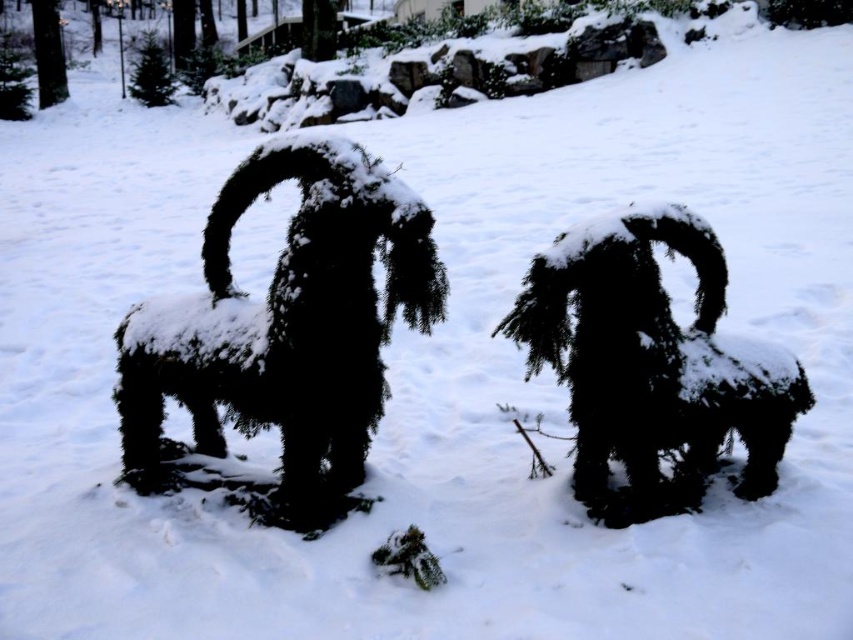
Is green textured evergreen at center thinner than fuzzy dark green bush at center?

Incorrect, green textured evergreen at center's width is not less than fuzzy dark green bush at center's.

You are a GUI agent. You are given a task and a screenshot of the screen. Output one action in this format:
    pyautogui.click(x=<x>, y=<y>)
    Task: Click on the green textured evergreen at center
    The image size is (853, 640).
    Given the screenshot: What is the action you would take?
    pyautogui.click(x=285, y=330)

What do you see at coordinates (285, 330) in the screenshot? I see `green textured evergreen at center` at bounding box center [285, 330].

I want to click on green textured evergreen at center, so click(x=285, y=330).